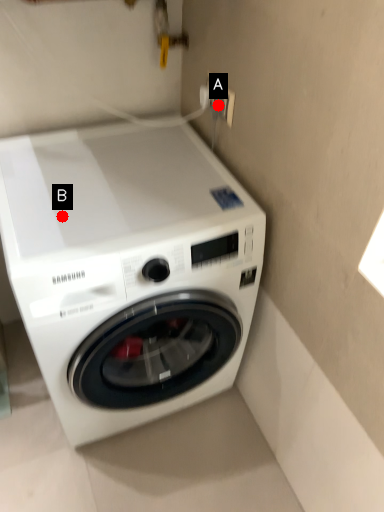
Question: Two points are circled on the image, labeled by A and B beside each circle. Which point appears closest to the camera in this image?

Choices:
 (A) A is closer
 (B) B is closer

Answer: (B)